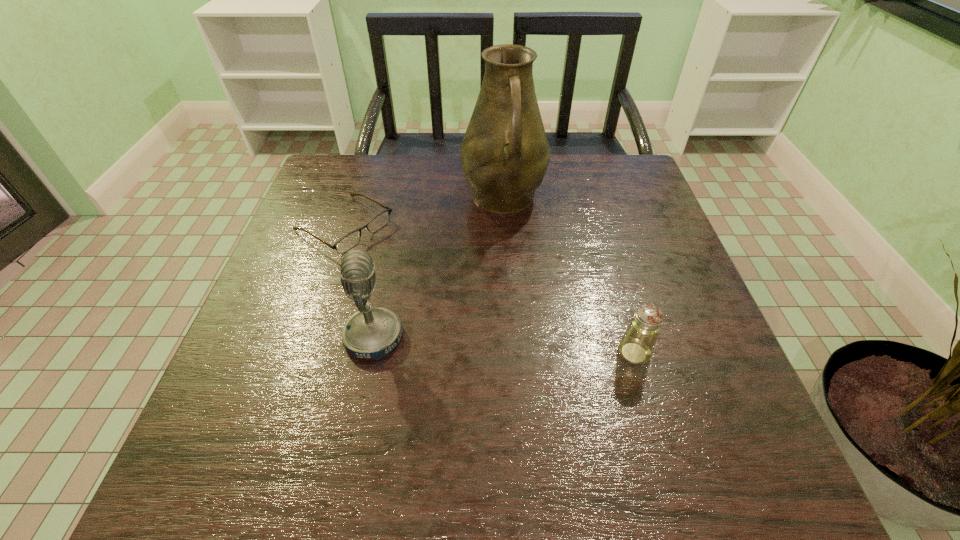
Where is `free space between the spectacles and the saltshaker`? The width and height of the screenshot is (960, 540). free space between the spectacles and the saltshaker is located at coordinates click(x=490, y=289).

I want to click on empty space between the tallest object and the third shortest object, so click(439, 268).

At what (x,y) coordinates should I click in order to perform the action: click on vacant point located between the tallest object and the second tallest object. Please return your answer as a coordinate pair (x, y). The height and width of the screenshot is (540, 960). Looking at the image, I should click on (439, 268).

Locate an element on the screen. This screenshot has width=960, height=540. vacant space in between the second object from right to left and the shortest object is located at coordinates (424, 212).

Choose which object is the nearest neighbor to the third tallest object. Please provide its 2D coordinates. Your answer should be formatted as a tuple, i.e. [(x, y)], where the tuple contains the x and y coordinates of a point satisfying the conditions above.

[(505, 153)]

Identify which object is located as the second nearest to the tallest object. Please provide its 2D coordinates. Your answer should be formatted as a tuple, i.e. [(x, y)], where the tuple contains the x and y coordinates of a point satisfying the conditions above.

[(373, 332)]

This screenshot has width=960, height=540. I want to click on vacant space that satisfies the following two spatial constraints: 1. on the front side of the spectacles; 2. on the left side of the rightmost object, so click(302, 353).

Where is `vacant region that satisfies the following two spatial constraints: 1. on the front side of the saltshaker; 2. on the left side of the tallest object`? vacant region that satisfies the following two spatial constraints: 1. on the front side of the saltshaker; 2. on the left side of the tallest object is located at coordinates (513, 353).

The height and width of the screenshot is (540, 960). I want to click on vacant space that satisfies the following two spatial constraints: 1. on the front side of the shortest object; 2. on the front-facing side of the microphone, so click(x=307, y=338).